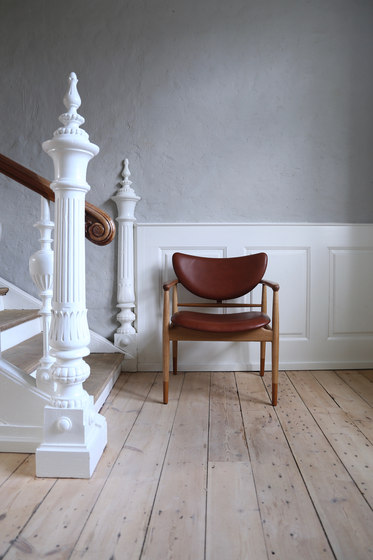
Identify the location of bottom step. The height and width of the screenshot is (560, 373). pos(100,365).